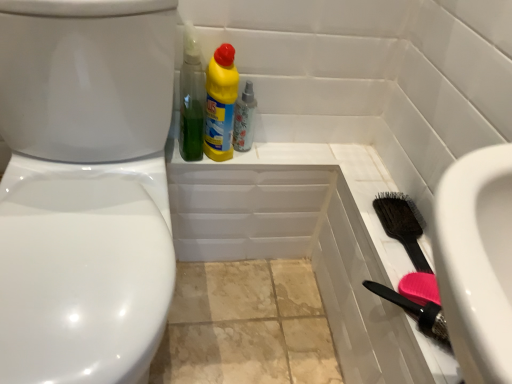
Where is `green plastic bottle at upper center, positioned as the 2th cleaning product in right-to-left order`? green plastic bottle at upper center, positioned as the 2th cleaning product in right-to-left order is located at coordinates tap(191, 98).

The height and width of the screenshot is (384, 512). I want to click on white glossy bidet at left, so click(x=83, y=270).

Which object is closer to the camera taking this photo, floral-patterned glass spray bottle at upper center or white glossy bidet at left?

white glossy bidet at left.

Is floral-patterned glass spray bottle at upper center looking in the opposite direction of white glossy bidet at left?

floral-patterned glass spray bottle at upper center does not have its back to white glossy bidet at left.

You are a GUI agent. You are given a task and a screenshot of the screen. Output one action in this format:
    pyautogui.click(x=<x>, y=<y>)
    Task: Click on the bottle that is above the white glossy bidet at left (from a real-world perspective)
    This screenshot has width=512, height=384.
    Given the screenshot: What is the action you would take?
    pyautogui.click(x=244, y=119)

From their relative heights in the image, would you say floral-patterned glass spray bottle at upper center is taller or shorter than white glossy bidet at left?

Clearly, floral-patterned glass spray bottle at upper center is shorter compared to white glossy bidet at left.

Is black bristle brush at right in front of yellow plastic bottle at upper center, the 2th cleaning product positioned from the left?

Yes, black bristle brush at right is closer to the viewer.

Are black bristle brush at right and yellow plastic bottle at upper center, the 1th cleaning product positioned from the right, making contact?

No, black bristle brush at right is not with yellow plastic bottle at upper center, the 1th cleaning product positioned from the right.

Between black bristle brush at right and yellow plastic bottle at upper center, the 2th cleaning product positioned from the left, which one appears on the right side from the viewer's perspective?

black bristle brush at right is more to the right.

Is black bristle brush at right positioned with its back to yellow plastic bottle at upper center, the 1th cleaning product positioned from the right?

That's not correct — black bristle brush at right is not looking away from yellow plastic bottle at upper center, the 1th cleaning product positioned from the right.

The height and width of the screenshot is (384, 512). I want to click on bottle above the white glossy bidet at left (from a real-world perspective), so click(x=244, y=119).

Can you confirm if white glossy bidet at left is thinner than floral-patterned glass spray bottle at upper center?

No, white glossy bidet at left is not thinner than floral-patterned glass spray bottle at upper center.

In the scene shown: Is white glossy bidet at left completely or partially outside of floral-patterned glass spray bottle at upper center?

That's correct, white glossy bidet at left is outside of floral-patterned glass spray bottle at upper center.

Considering the positions of objects white glossy bidet at left and floral-patterned glass spray bottle at upper center in the image provided, who is more to the right, white glossy bidet at left or floral-patterned glass spray bottle at upper center?

From the viewer's perspective, floral-patterned glass spray bottle at upper center appears more on the right side.

Is black bristle brush at right wider than floral-patterned glass spray bottle at upper center?

Correct, the width of black bristle brush at right exceeds that of floral-patterned glass spray bottle at upper center.

From the image's perspective, which is above, black bristle brush at right or floral-patterned glass spray bottle at upper center?

From the image's view, floral-patterned glass spray bottle at upper center is above.

Is black bristle brush at right situated inside floral-patterned glass spray bottle at upper center or outside?

black bristle brush at right is not enclosed by floral-patterned glass spray bottle at upper center.

Between black bristle brush at right and floral-patterned glass spray bottle at upper center, which one is positioned in front?

black bristle brush at right is more forward.

Does green plastic bottle at upper center, the 1th cleaning product viewed from the left, appear on the right side of yellow plastic bottle at upper center, the 1th cleaning product positioned from the right?

No.

In order to click on cleaning product that appears behind the green plastic bottle at upper center, positioned as the 2th cleaning product in right-to-left order in this screenshot , I will do `click(220, 103)`.

From their relative heights in the image, would you say floral-patterned glass spray bottle at upper center is taller or shorter than black bristle brush at right?

In the image, floral-patterned glass spray bottle at upper center appears to be taller than black bristle brush at right.

From the image's perspective, is floral-patterned glass spray bottle at upper center above or below black bristle brush at right?

Clearly, from the image's perspective, floral-patterned glass spray bottle at upper center is above black bristle brush at right.

From the picture: How many degrees apart are the facing directions of floral-patterned glass spray bottle at upper center and black bristle brush at right?

The facing directions of floral-patterned glass spray bottle at upper center and black bristle brush at right are 90.3 degrees apart.

Find the location of a particular element. Image resolution: width=512 pixels, height=384 pixels. brush directly beneath the floral-patterned glass spray bottle at upper center (from a real-world perspective) is located at coordinates coord(402,225).

Is yellow plastic bottle at upper center, the 1th cleaning product positioned from the right, positioned beyond the bounds of floral-patterned glass spray bottle at upper center?

Yes, yellow plastic bottle at upper center, the 1th cleaning product positioned from the right, is outside of floral-patterned glass spray bottle at upper center.

Is yellow plastic bottle at upper center, the 2th cleaning product positioned from the left, with floral-patterned glass spray bottle at upper center?

Yes, yellow plastic bottle at upper center, the 2th cleaning product positioned from the left, and floral-patterned glass spray bottle at upper center clearly make contact.

Between yellow plastic bottle at upper center, the 2th cleaning product positioned from the left, and floral-patterned glass spray bottle at upper center, which one has less height?

Standing shorter between the two is floral-patterned glass spray bottle at upper center.

Can you tell me how much yellow plastic bottle at upper center, the 2th cleaning product positioned from the left, and floral-patterned glass spray bottle at upper center differ in facing direction?

yellow plastic bottle at upper center, the 2th cleaning product positioned from the left, and floral-patterned glass spray bottle at upper center are facing 0.000437 degrees away from each other.

The width and height of the screenshot is (512, 384). In order to click on bidet in front of the floral-patterned glass spray bottle at upper center in this screenshot , I will do `click(83, 270)`.

Where is `brush that is below the yellow plastic bottle at upper center, the 1th cleaning product positioned from the right (from the image's perspective)`? This screenshot has height=384, width=512. brush that is below the yellow plastic bottle at upper center, the 1th cleaning product positioned from the right (from the image's perspective) is located at coordinates [402, 225].

From the image, which object appears to be farther from floral-patterned glass spray bottle at upper center, green plastic bottle at upper center, positioned as the 2th cleaning product in right-to-left order, or black bristle brush at right?

black bristle brush at right is positioned further to the anchor floral-patterned glass spray bottle at upper center.

Considering their positions, is green plastic bottle at upper center, the 1th cleaning product viewed from the left, positioned further to black bristle brush at right than floral-patterned glass spray bottle at upper center?

green plastic bottle at upper center, the 1th cleaning product viewed from the left, lies further to black bristle brush at right than the other object.

Estimate the real-world distances between objects in this image. Which object is further from floral-patterned glass spray bottle at upper center, black bristle brush at right or yellow plastic bottle at upper center, the 2th cleaning product positioned from the left?

Among the two, black bristle brush at right is located further to floral-patterned glass spray bottle at upper center.

Estimate the real-world distances between objects in this image. Which object is closer to white glossy bidet at left, floral-patterned glass spray bottle at upper center or yellow plastic bottle at upper center, the 2th cleaning product positioned from the left?

yellow plastic bottle at upper center, the 2th cleaning product positioned from the left, lies closer to white glossy bidet at left than the other object.

Looking at this image, which object lies further to the anchor point green plastic bottle at upper center, the 1th cleaning product viewed from the left, black bristle brush at right or white glossy bidet at left?

black bristle brush at right is positioned further to the anchor green plastic bottle at upper center, the 1th cleaning product viewed from the left.

Looking at the image, which one is located further to green plastic bottle at upper center, the 1th cleaning product viewed from the left, yellow plastic bottle at upper center, the 1th cleaning product positioned from the right, or black bristle brush at right?

The object further to green plastic bottle at upper center, the 1th cleaning product viewed from the left, is black bristle brush at right.

Based on their spatial positions, is yellow plastic bottle at upper center, the 1th cleaning product positioned from the right, or floral-patterned glass spray bottle at upper center further from white glossy bidet at left?

The object further to white glossy bidet at left is floral-patterned glass spray bottle at upper center.

Based on their spatial positions, is floral-patterned glass spray bottle at upper center or yellow plastic bottle at upper center, the 1th cleaning product positioned from the right, further from green plastic bottle at upper center, positioned as the 2th cleaning product in right-to-left order?

floral-patterned glass spray bottle at upper center.

In order to click on cleaning product between green plastic bottle at upper center, positioned as the 2th cleaning product in right-to-left order, and black bristle brush at right from left to right in this screenshot , I will do `click(220, 103)`.

Locate an element on the screen. brush located between white glossy bidet at left and floral-patterned glass spray bottle at upper center in the depth direction is located at coordinates (402, 225).

The height and width of the screenshot is (384, 512). Find the location of `bottle between yellow plastic bottle at upper center, the 2th cleaning product positioned from the left, and black bristle brush at right`. bottle between yellow plastic bottle at upper center, the 2th cleaning product positioned from the left, and black bristle brush at right is located at coordinates (244, 119).

At what (x,y) coordinates should I click in order to perform the action: click on cleaning product located between green plastic bottle at upper center, positioned as the 2th cleaning product in right-to-left order, and floral-patterned glass spray bottle at upper center in the depth direction. Please return your answer as a coordinate pair (x, y). Image resolution: width=512 pixels, height=384 pixels. Looking at the image, I should click on (220, 103).